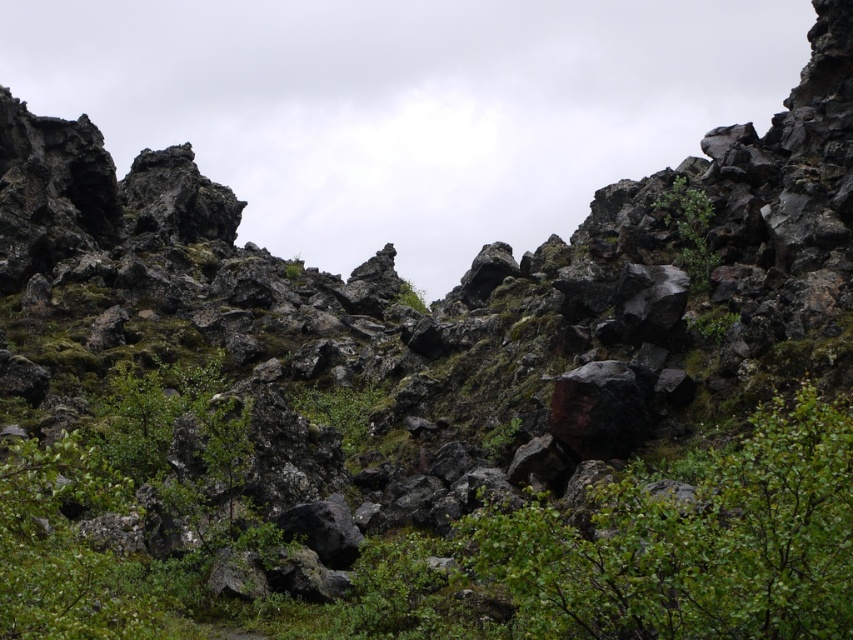
Question: Can you confirm if green leafy shrubs at center is smaller than green leafy shrub at upper right?

Choices:
 (A) no
 (B) yes

Answer: (A)

Question: Which point appears farthest from the camera in this image?

Choices:
 (A) (57, 557)
 (B) (666, 305)

Answer: (B)

Question: Does shiny black rock at center-right have a lesser width compared to green leafy shrub at upper right?

Choices:
 (A) no
 (B) yes

Answer: (B)

Question: Which object is positioned farthest from the shiny black rock at center-right?

Choices:
 (A) green leafy shrub at upper right
 (B) green leafy shrubs at center

Answer: (B)

Question: Which of the following is the closest to the observer?

Choices:
 (A) shiny black rock at center-right
 (B) green leafy shrubs at center

Answer: (B)

Question: Is green leafy shrubs at center to the right of green leafy shrub at upper right from the viewer's perspective?

Choices:
 (A) no
 (B) yes

Answer: (A)